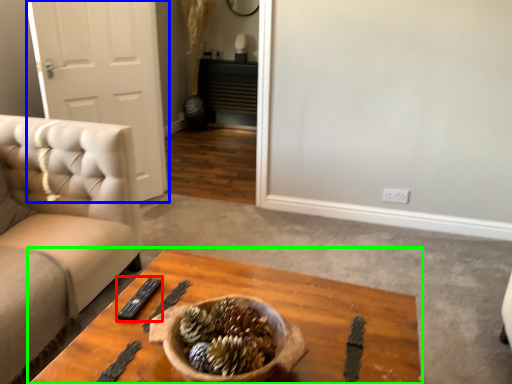
Question: Which object is positioned closest to remote (highlighted by a red box)? Select from door (highlighted by a blue box) and coffee table (highlighted by a green box).

Choices:
 (A) door
 (B) coffee table

Answer: (B)